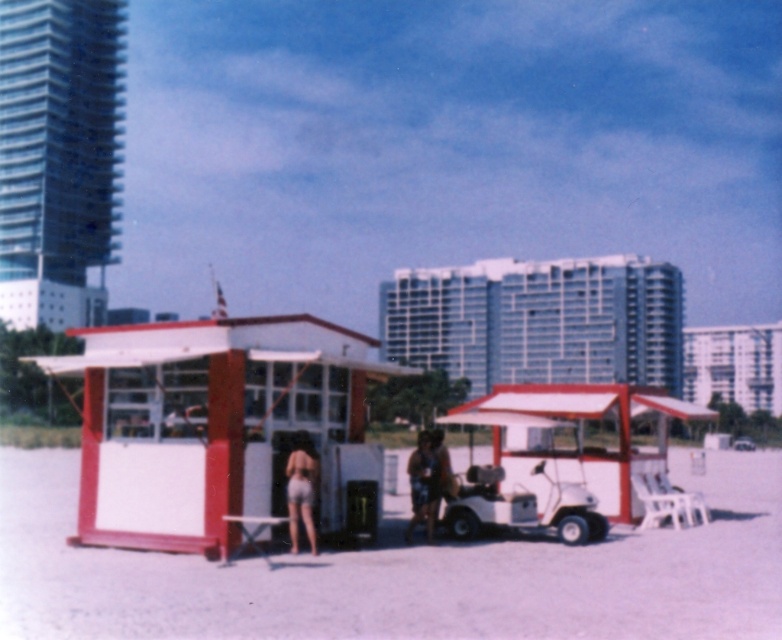
Does white plastic chair at center lie in front of white painted wood hut at center?

Yes, it is.

Is white plastic chair at center below white painted wood hut at center?

Correct, white plastic chair at center is located below white painted wood hut at center.

Between point (676, 448) and point (138, 484), which one is positioned in front?

Point (138, 484) is in front.

What are the coordinates of `white plastic chair at center` in the screenshot? It's located at (402, 573).

Between white plastic chair at center and matte brown shorts at center, which one appears on the left side from the viewer's perspective?

matte brown shorts at center

Is white plastic chair at center to the left of matte brown shorts at center from the viewer's perspective?

In fact, white plastic chair at center is to the right of matte brown shorts at center.

Which is in front, point (81, 586) or point (411, 508)?

Positioned in front is point (81, 586).

At what (x,y) coordinates should I click in order to perform the action: click on white plastic chair at center. Please return your answer as a coordinate pair (x, y). Looking at the image, I should click on (402, 573).

Between white painted wood hut at center and light blue denim shorts at center, which one appears on the left side from the viewer's perspective?

Positioned to the left is white painted wood hut at center.

Between white painted wood hut at center and light blue denim shorts at center, which one appears on the right side from the viewer's perspective?

light blue denim shorts at center

Between point (253, 445) and point (296, 550), which one is positioned in front?

Point (253, 445) is in front.

Find the location of a particular element. white painted wood hut at center is located at coordinates (203, 419).